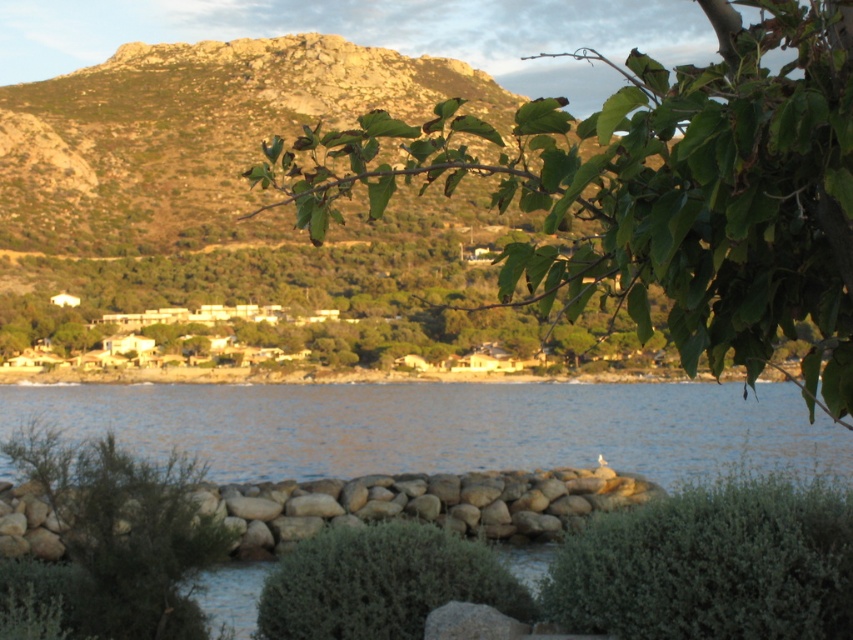
Does green leafy branch at upper center have a greater width compared to green fuzzy bush at center?

Correct, the width of green leafy branch at upper center exceeds that of green fuzzy bush at center.

Is point (573, 168) closer to camera compared to point (497, 572)?

Yes, point (573, 168) is in front of point (497, 572).

This screenshot has height=640, width=853. I want to click on green leafy branch at upper center, so click(x=657, y=193).

Between green leafy branch at upper center and green leafy bush at lower left, which one is positioned lower?

green leafy bush at lower left is below.

Is point (399, 168) farther from camera compared to point (73, 545)?

Yes, it is.

Who is more forward, (561, 272) or (64, 508)?

Point (561, 272) is in front.

This screenshot has height=640, width=853. In order to click on green leafy branch at upper center in this screenshot , I will do `click(657, 193)`.

Does green leafy bush at lower left come in front of green fuzzy bush at center?

That is False.

You are a GUI agent. You are given a task and a screenshot of the screen. Output one action in this format:
    pyautogui.click(x=<x>, y=<y>)
    Task: Click on the green leafy bush at lower left
    
    Given the screenshot: What is the action you would take?
    pyautogui.click(x=120, y=536)